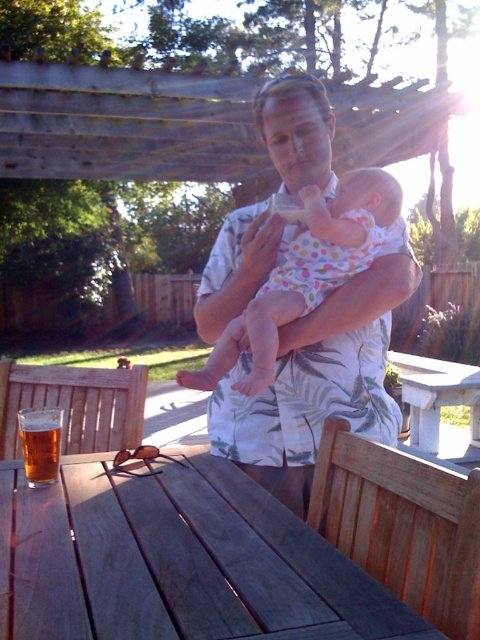
You are a photographer setting up equipment in the garden. You have a white floral shirt at center and a white stone picnic table at center in your viewfinder. Which object is taller when viewed from your position?

The white floral shirt at center is taller than the white stone picnic table at center.

You are a parent who just arrived home and wants to place the golden amber liquid at table left into the white polka dot fabric baby at center. Can you do this without moving either object?

The white polka dot fabric baby at center and golden amber liquid at table left are 43.37 centimeters apart. Since the distance is too far, you cannot place the golden amber liquid at table left into the white polka dot fabric baby at center without moving either object.

Looking at this image, you are standing in the garden and want to reach the point marked as point (x=215, y=289). If your walking speed is 3 feet per second, how long will it take you to reach that point?

The point (x=215, y=289) is 5.50 feet from the camera. Since you are standing at the camera position, it will take you approximately 1.83 seconds to reach the point at a speed of 3 feet per second.